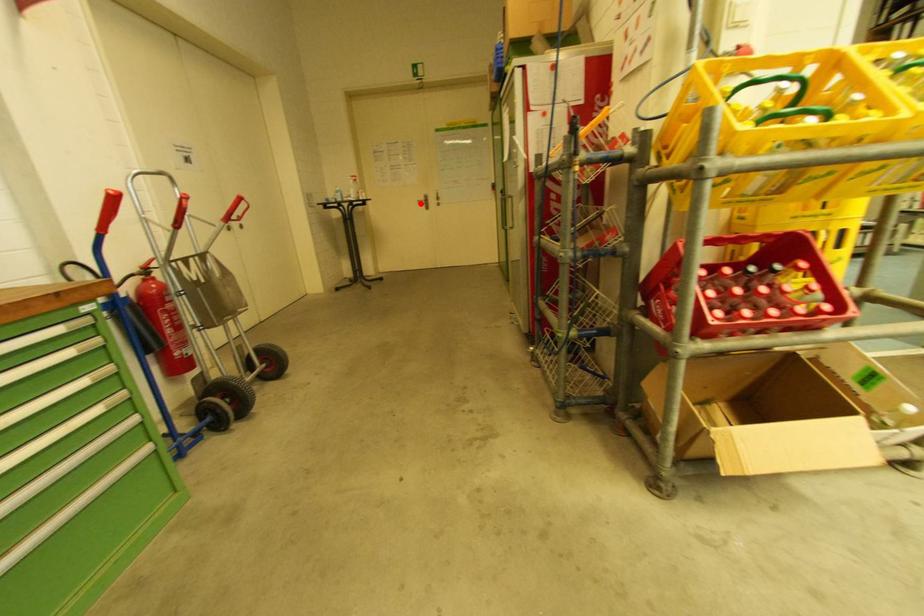
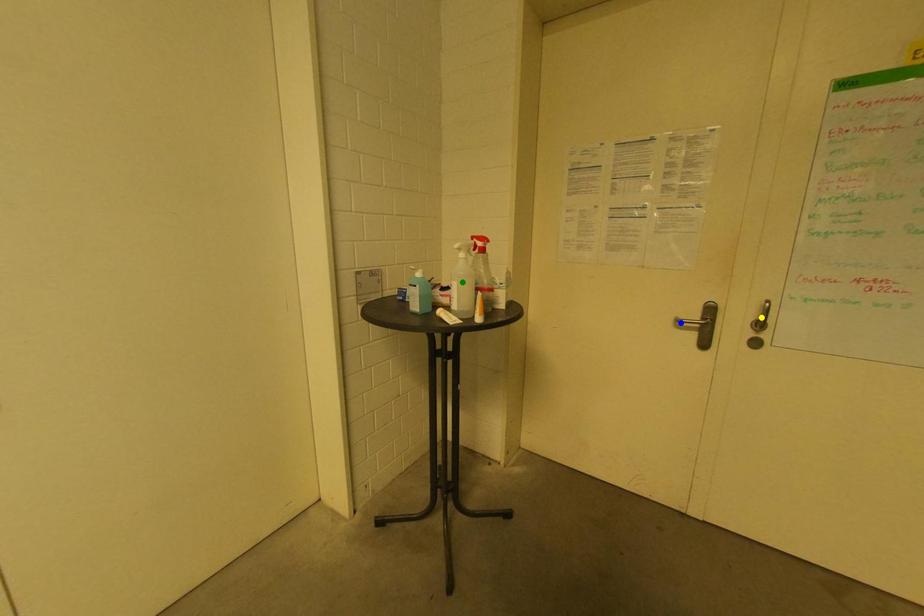
Question: I am providing you with two images of the same scene from different viewpoints. A red point is marked on the first image. You are given multiple points on the second image. Which spot in image 2 lines up with the point in image 1?

Choices:
 (A) blue point
 (B) green point
 (C) yellow point

Answer: (A)